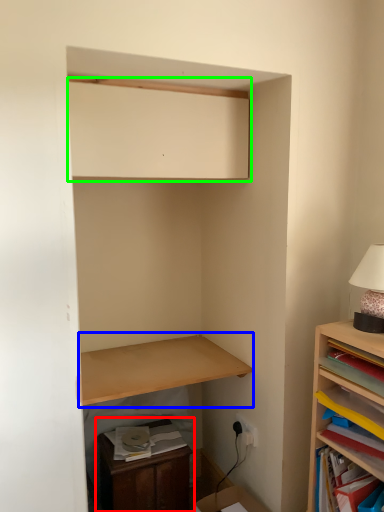
Question: Based on their relative distances, which object is nearer to dresser (highlighted by a red box)? Choose from shelf (highlighted by a blue box) and medicine cabinet (highlighted by a green box).

Choices:
 (A) shelf
 (B) medicine cabinet

Answer: (A)